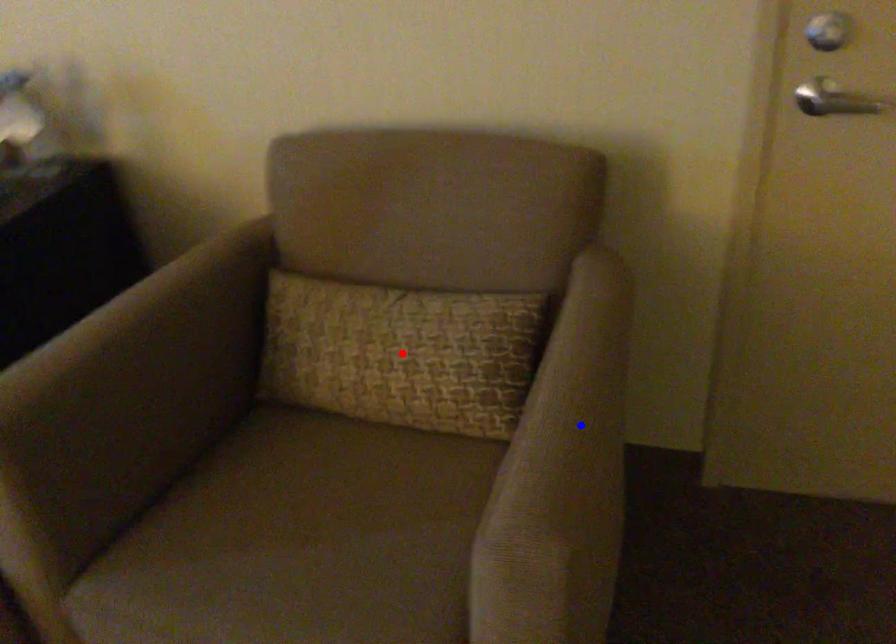
Question: Two points are marked on the image. Which point is closer to the camera?

Choices:
 (A) Blue point is closer.
 (B) Red point is closer.

Answer: (A)